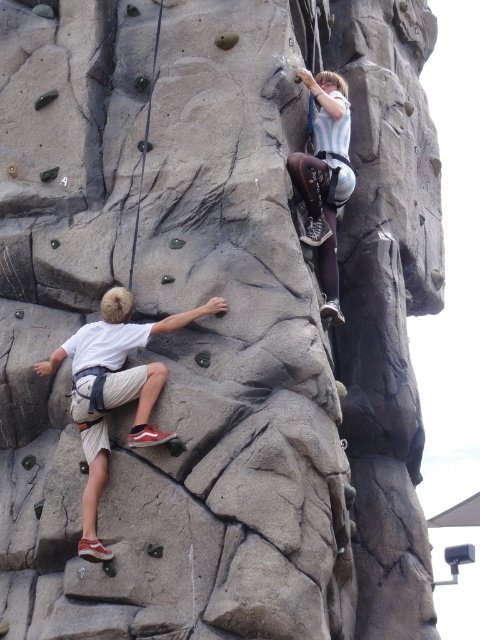
Based on the photo, you are a photographer at the base of the climbing wall. You need to capture both the climber in the white cotton shirt at left and the climber in the striped fabric shirt at upper right in a single shot. Which climber should you focus on first to ensure they are in the frame?

You should focus on the white cotton shirt at left first because it is larger and more prominent in the frame compared to the striped fabric shirt at upper right.

You are a photographer positioned at the base of the climbing wall. You need to capture a photo that includes both the white cotton shirt at left and the striped fabric shirt at upper right. Based on their positions, which shirt will appear higher in the photo?

The striped fabric shirt at upper right will appear higher in the photo because it is positioned above the white cotton shirt at left.